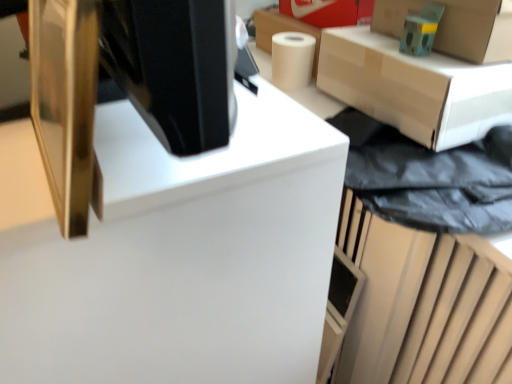
What do you see at coordinates (420, 30) in the screenshot?
I see `teal matte toy at upper right` at bounding box center [420, 30].

Locate an element on the screen. This screenshot has width=512, height=384. cardboard box at upper right is located at coordinates (456, 27).

At what (x,y) coordinates should I click in order to perform the action: click on matte cardboard box at upper right. Please return your answer as a coordinate pair (x, y). This screenshot has width=512, height=384. Looking at the image, I should click on (414, 87).

Identify the location of white glossy computer desk at center. The image size is (512, 384). (183, 257).

What do you see at coordinates (183, 257) in the screenshot?
I see `white glossy computer desk at center` at bounding box center [183, 257].

Where is `gold metallic monitor at upper left`? This screenshot has height=384, width=512. gold metallic monitor at upper left is located at coordinates [127, 81].

This screenshot has width=512, height=384. In order to click on teal matte toy at upper right in this screenshot , I will do `click(420, 30)`.

From the image's perspective, is gold metallic monitor at upper left located above or below white glossy computer desk at center?

Based on their image positions, gold metallic monitor at upper left is located above white glossy computer desk at center.

Is gold metallic monitor at upper left in contact with white glossy computer desk at center?

No, gold metallic monitor at upper left is not touching white glossy computer desk at center.

Is gold metallic monitor at upper left inside or outside of white glossy computer desk at center?

gold metallic monitor at upper left lies outside white glossy computer desk at center.

Considering the sizes of objects gold metallic monitor at upper left and white glossy computer desk at center in the image provided, who is wider, gold metallic monitor at upper left or white glossy computer desk at center?

white glossy computer desk at center is wider.

In the scene shown: From a real-world perspective, is white matte paper towel at upper right positioned above or below gold metallic monitor at upper left?

Clearly, from a real-world perspective, white matte paper towel at upper right is below gold metallic monitor at upper left.

From the image's perspective, is white matte paper towel at upper right on gold metallic monitor at upper left?

Indeed, from the image's perspective, white matte paper towel at upper right is shown above gold metallic monitor at upper left.

Would you consider white matte paper towel at upper right to be distant from gold metallic monitor at upper left?

Actually, white matte paper towel at upper right and gold metallic monitor at upper left are a little close together.

Can you confirm if white matte paper towel at upper right is bigger than gold metallic monitor at upper left?

No.

From a real-world perspective, which is physically below, cardboard box at upper right or white glossy computer desk at center?

white glossy computer desk at center, from a real-world perspective.

Does cardboard box at upper right have a lesser width compared to white glossy computer desk at center?

Correct, the width of cardboard box at upper right is less than that of white glossy computer desk at center.

Can you confirm if cardboard box at upper right is positioned to the left of white glossy computer desk at center?

No, cardboard box at upper right is not to the left of white glossy computer desk at center.

Which is in front, cardboard box at upper right or white glossy computer desk at center?

white glossy computer desk at center is in front.

Is white glossy computer desk at center situated inside matte cardboard box at upper right or outside?

white glossy computer desk at center is not enclosed by matte cardboard box at upper right.

Is white glossy computer desk at center bigger than matte cardboard box at upper right?

Yes, white glossy computer desk at center is bigger than matte cardboard box at upper right.

Is white glossy computer desk at center positioned far away from matte cardboard box at upper right?

No, white glossy computer desk at center is not far away from matte cardboard box at upper right.

Is white glossy computer desk at center to the right of matte cardboard box at upper right from the viewer's perspective?

In fact, white glossy computer desk at center is to the left of matte cardboard box at upper right.

From a real-world perspective, between teal matte toy at upper right and cardboard box at upper right, who is vertically higher?

From a 3D spatial view, cardboard box at upper right is above.

From the image's perspective, would you say teal matte toy at upper right is shown under cardboard box at upper right?

Correct, teal matte toy at upper right appears lower than cardboard box at upper right in the image.

Is teal matte toy at upper right facing towards cardboard box at upper right?

No, teal matte toy at upper right is not facing towards cardboard box at upper right.

How different are the orientations of teal matte toy at upper right and cardboard box at upper right in degrees?

teal matte toy at upper right and cardboard box at upper right are facing 13.8 degrees away from each other.

At what (x,y) coordinates should I click in order to perform the action: click on box in front of the matte cardboard box at upper right. Please return your answer as a coordinate pair (x, y). The width and height of the screenshot is (512, 384). Looking at the image, I should click on (456, 27).

Is cardboard box at upper right further to the viewer compared to matte cardboard box at upper right?

That is False.

Looking at this image, considering the sizes of objects cardboard box at upper right and matte cardboard box at upper right in the image provided, who is smaller, cardboard box at upper right or matte cardboard box at upper right?

cardboard box at upper right.

Considering the positions of point (510, 22) and point (388, 57), is point (510, 22) closer or farther from the camera than point (388, 57)?

Point (510, 22) appears to be closer to the viewer than point (388, 57).

Is gold metallic monitor at upper left taller or shorter than matte cardboard box at upper right?

In the image, gold metallic monitor at upper left appears to be taller than matte cardboard box at upper right.

Relative to matte cardboard box at upper right, is gold metallic monitor at upper left in front or behind?

gold metallic monitor at upper left is positioned closer to the viewer than matte cardboard box at upper right.

Which object is thinner, gold metallic monitor at upper left or matte cardboard box at upper right?

gold metallic monitor at upper left is thinner.

Can you see gold metallic monitor at upper left touching matte cardboard box at upper right?

There is a gap between gold metallic monitor at upper left and matte cardboard box at upper right.

Identify the location of desktop computer located in front of the white glossy computer desk at center. (127, 81).

Find the location of a particular element. paper towel below the gold metallic monitor at upper left (from a real-world perspective) is located at coordinates (292, 59).

Estimate the real-world distances between objects in this image. Which object is further from cardboard box at upper right, teal matte toy at upper right or white glossy computer desk at center?

white glossy computer desk at center.

Consider the image. Looking at the image, which one is located closer to gold metallic monitor at upper left, white matte paper towel at upper right or white glossy computer desk at center?

The object closer to gold metallic monitor at upper left is white glossy computer desk at center.

From the image, which object appears to be nearer to white matte paper towel at upper right, cardboard box at upper right or gold metallic monitor at upper left?

Among the two, cardboard box at upper right is located nearer to white matte paper towel at upper right.

Estimate the real-world distances between objects in this image. Which object is closer to cardboard box at upper right, gold metallic monitor at upper left or white glossy computer desk at center?

white glossy computer desk at center lies closer to cardboard box at upper right than the other object.

Considering their positions, is gold metallic monitor at upper left positioned closer to cardboard box at upper right than matte cardboard box at upper right?

Among the two, matte cardboard box at upper right is located nearer to cardboard box at upper right.

In the scene shown: Estimate the real-world distances between objects in this image. Which object is closer to teal matte toy at upper right, white glossy computer desk at center or matte cardboard box at upper right?

Based on the image, matte cardboard box at upper right appears to be nearer to teal matte toy at upper right.

Estimate the real-world distances between objects in this image. Which object is further from white matte paper towel at upper right, gold metallic monitor at upper left or white glossy computer desk at center?

gold metallic monitor at upper left is positioned further to the anchor white matte paper towel at upper right.

Looking at the image, which one is located closer to white glossy computer desk at center, matte cardboard box at upper right or gold metallic monitor at upper left?

Among the two, gold metallic monitor at upper left is located nearer to white glossy computer desk at center.

Where is `paper towel between white glossy computer desk at center and cardboard box at upper right in the horizontal direction`? This screenshot has height=384, width=512. paper towel between white glossy computer desk at center and cardboard box at upper right in the horizontal direction is located at coordinates click(292, 59).

Identify the location of box between gold metallic monitor at upper left and white matte paper towel at upper right along the z-axis. (456, 27).

This screenshot has width=512, height=384. Find the location of `toy located between gold metallic monitor at upper left and white matte paper towel at upper right in the depth direction`. toy located between gold metallic monitor at upper left and white matte paper towel at upper right in the depth direction is located at coordinates (420, 30).

Locate an element on the screen. furniture between white glossy computer desk at center and cardboard box at upper right from left to right is located at coordinates (414, 87).